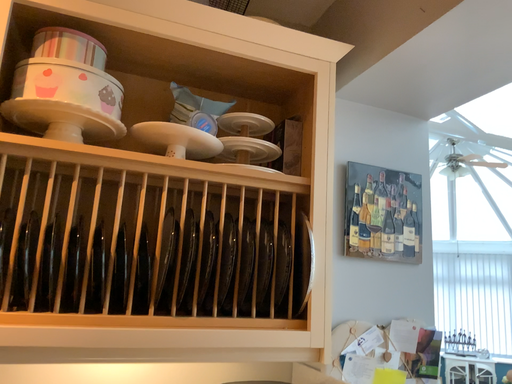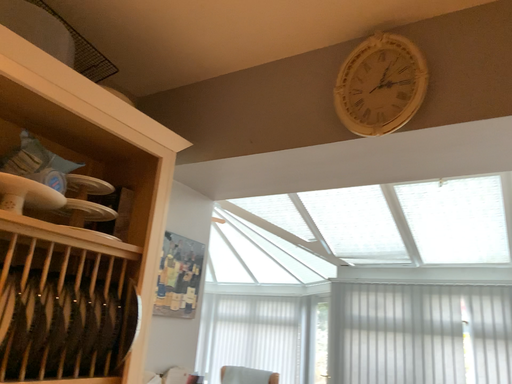
Question: How did the camera likely rotate when shooting the video?

Choices:
 (A) rotated left
 (B) rotated right

Answer: (B)